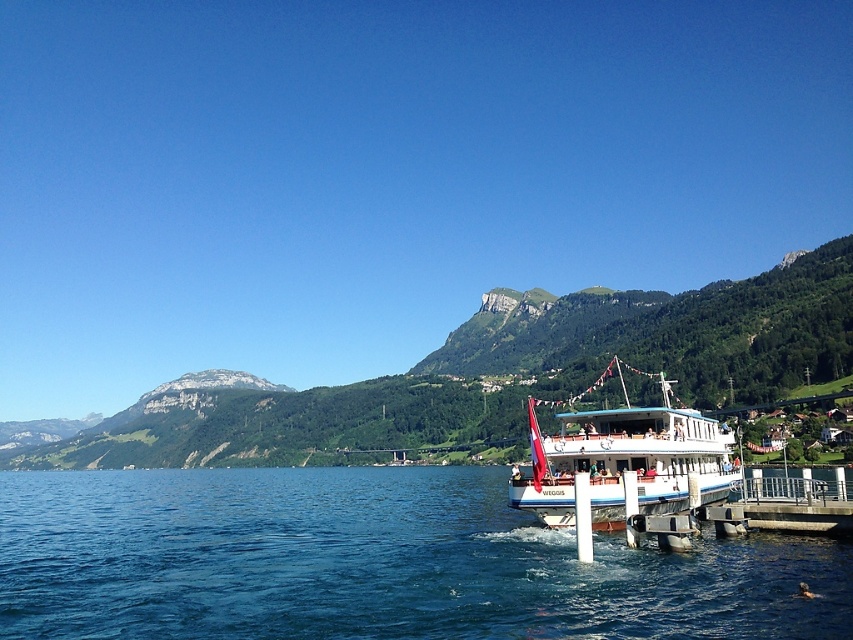
How distant is blue water at lower center from green grassy mountain at center?

The distance of blue water at lower center from green grassy mountain at center is 495.60 feet.

Describe the element at coordinates (373, 563) in the screenshot. This screenshot has height=640, width=853. I see `blue water at lower center` at that location.

Identify the location of blue water at lower center. This screenshot has width=853, height=640. (373, 563).

The height and width of the screenshot is (640, 853). Identify the location of blue water at lower center. (373, 563).

Between green grassy mountain at center and white concrete dock at lower right, which one has less height?

white concrete dock at lower right

Who is more distant from viewer, (x=701, y=381) or (x=838, y=516)?

Positioned behind is point (x=701, y=381).

Describe the element at coordinates (508, 372) in the screenshot. This screenshot has width=853, height=640. I see `green grassy mountain at center` at that location.

At what (x,y) coordinates should I click in order to perform the action: click on green grassy mountain at center. Please return your answer as a coordinate pair (x, y). This screenshot has height=640, width=853. Looking at the image, I should click on (508, 372).

Is point (378, 620) less distant than point (700, 420)?

Yes, point (378, 620) is in front of point (700, 420).

Between blue water at lower center and white glossy boat at center, which one has less height?

With less height is white glossy boat at center.

Identify the location of blue water at lower center. The height and width of the screenshot is (640, 853). (373, 563).